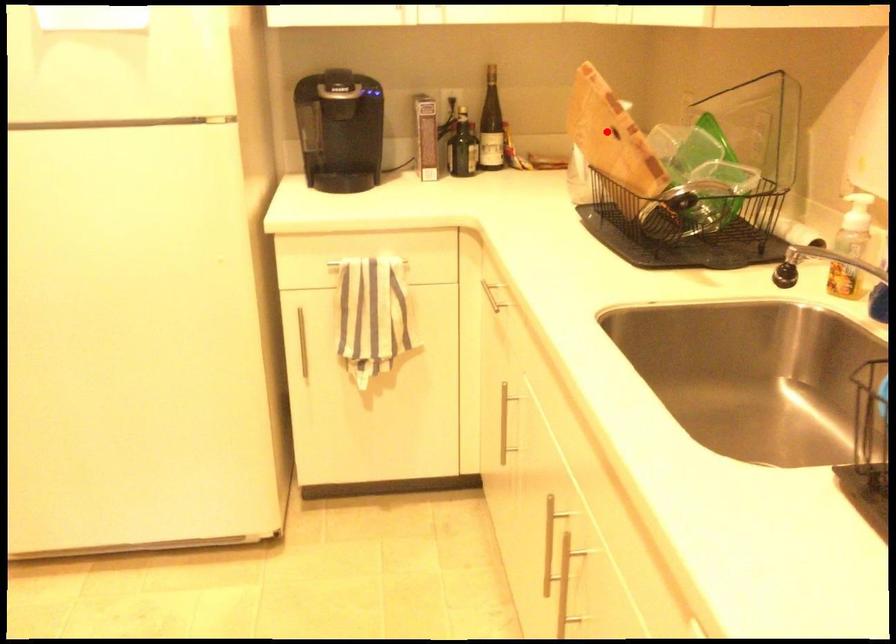
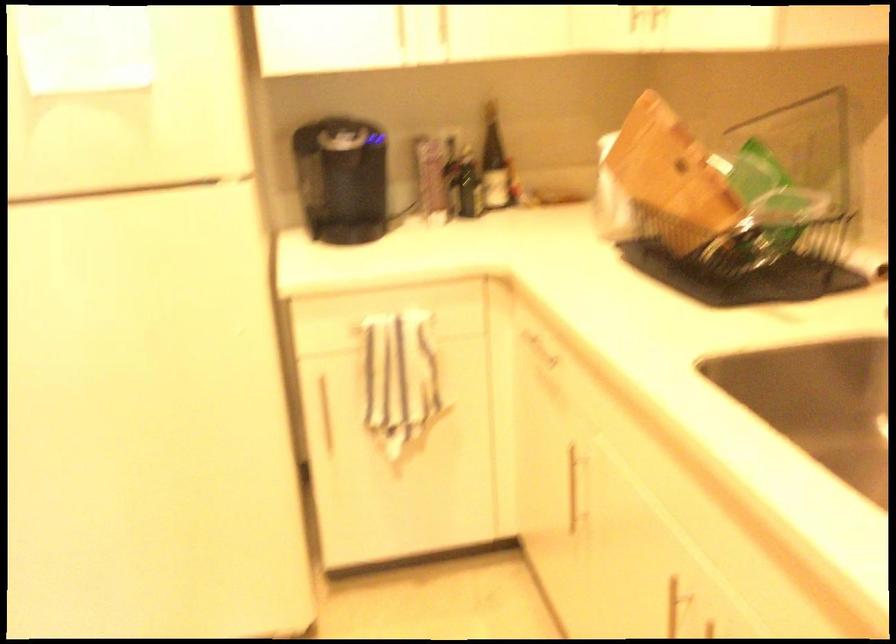
The point at the highlighted location is marked in the first image. Where is the corresponding point in the second image?

(670, 167)